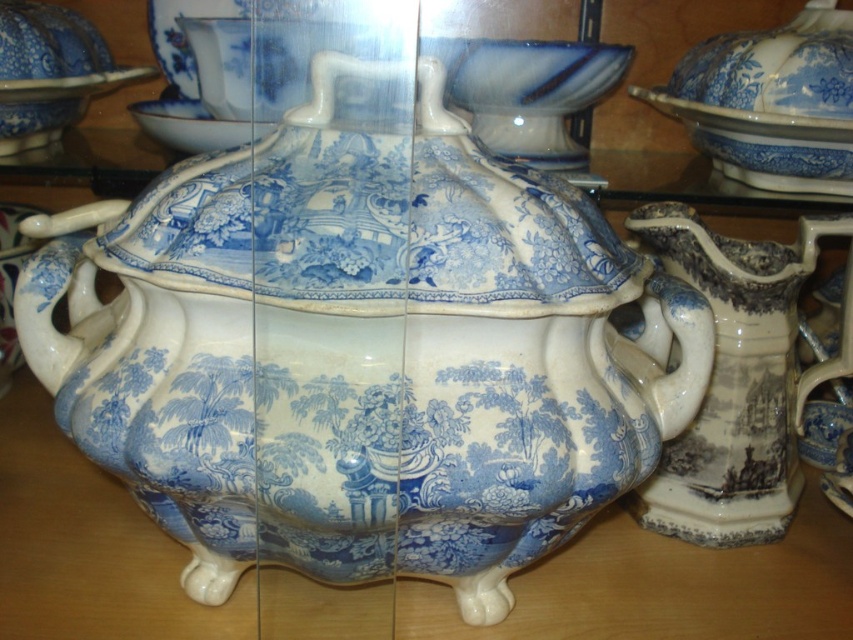
Question: Which of the following is the closest to the observer?

Choices:
 (A) (677, 216)
 (B) (21, 88)
 (C) (126, 428)

Answer: (C)

Question: Is blue glazed teapot at center further to camera compared to blue and white ceramic pitcher at right?

Choices:
 (A) no
 (B) yes

Answer: (A)

Question: Is blue glazed teapot at center to the right of blue and white ceramic pitcher at right from the viewer's perspective?

Choices:
 (A) yes
 (B) no

Answer: (B)

Question: Does blue glazed teapot at center appear on the left side of blue glazed plate at upper left?

Choices:
 (A) yes
 (B) no

Answer: (B)

Question: Which point is closer to the camera?

Choices:
 (A) blue and white ceramic pitcher at right
 (B) blue glazed plate at upper left

Answer: (A)

Question: Which object is closer to the camera taking this photo?

Choices:
 (A) blue and white ceramic pitcher at right
 (B) blue glazed plate at upper left
 (C) blue glazed teapot at center

Answer: (C)